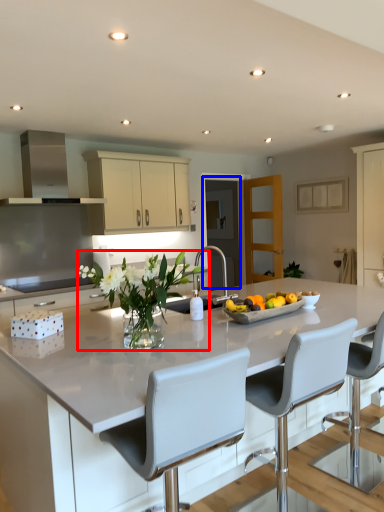
Question: Which of the following is the farthest to the observer, floral arrangement (highlighted by a red box) or glass door (highlighted by a blue box)?

Choices:
 (A) floral arrangement
 (B) glass door

Answer: (B)